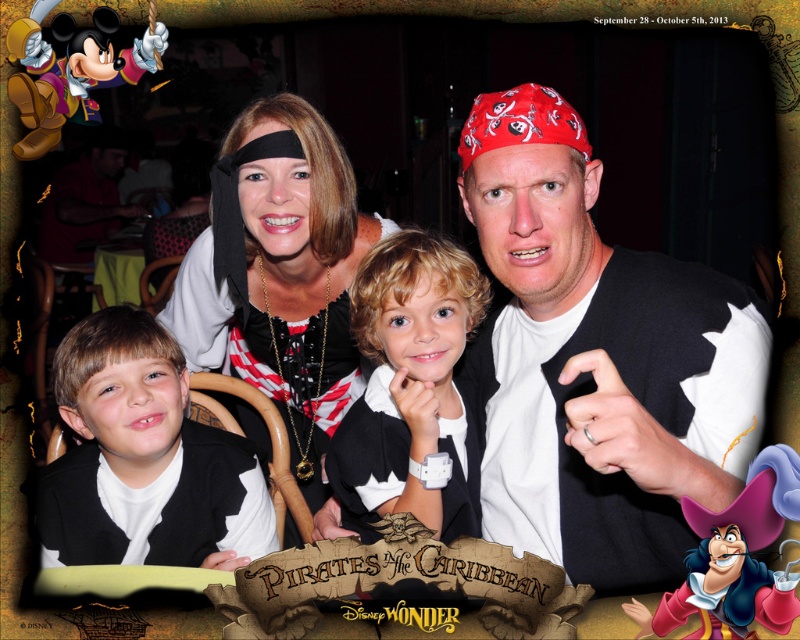
Who is more distant from viewer, [580,216] or [184,497]?

Point [184,497]

Locate an element on the screen. The image size is (800, 640). white matte vest at center is located at coordinates (598, 360).

You are a GUI agent. You are given a task and a screenshot of the screen. Output one action in this format:
    pyautogui.click(x=<x>, y=<y>)
    Task: Click on the white matte vest at center
    
    Given the screenshot: What is the action you would take?
    pyautogui.click(x=598, y=360)

Is point (728, 426) behind point (450, 296)?

That is False.

Which is more to the right, white matte vest at center or white matte shirt at center?

From the viewer's perspective, white matte vest at center appears more on the right side.

Does point (492, 243) come in front of point (381, 428)?

Yes.

Locate an element on the screen. The height and width of the screenshot is (640, 800). white matte vest at center is located at coordinates (598, 360).

Is point (182, 316) closer to viewer compared to point (146, 484)?

That is False.

Is black matte pirate costume at center above matte black vest at center?

Indeed, black matte pirate costume at center is positioned over matte black vest at center.

Between point (293, 177) and point (194, 502), which one is positioned in front?

Point (194, 502)

Identify the location of black matte pirate costume at center. The width and height of the screenshot is (800, 640). (280, 275).